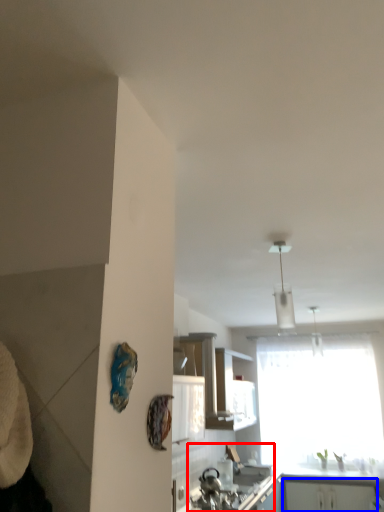
Question: Among these objects, which one is nearest to the camera, sink (highlighted by a red box) or cabinetry (highlighted by a blue box)?

Choices:
 (A) sink
 (B) cabinetry

Answer: (A)